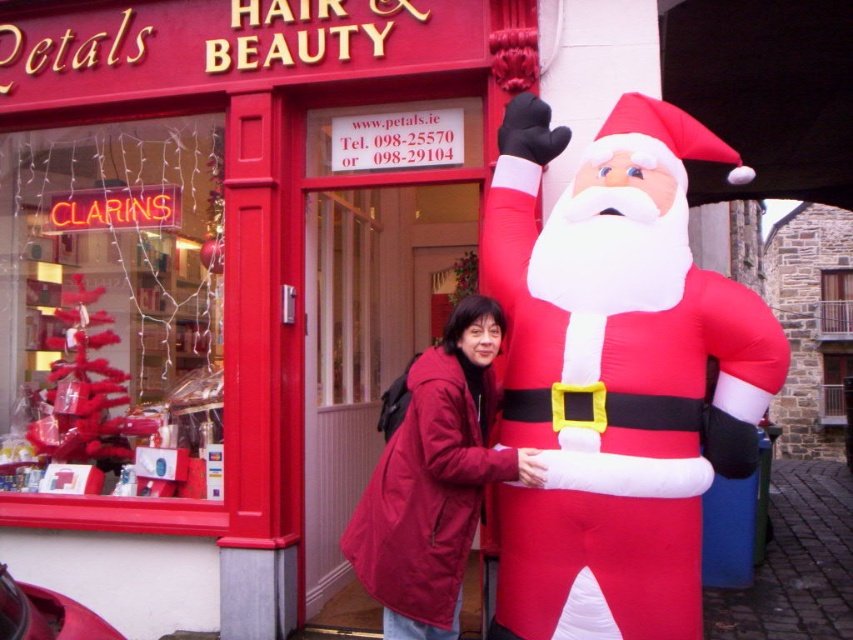
Is inflatable red santa claus at right smaller than matte red coat at center?

No.

Identify the location of inflatable red santa claus at right. The image size is (853, 640). (614, 376).

Is point (724, 332) closer to camera compared to point (410, 474)?

No, (724, 332) is behind (410, 474).

You are a GUI agent. You are given a task and a screenshot of the screen. Output one action in this format:
    pyautogui.click(x=<x>, y=<y>)
    Task: Click on the inflatable red santa claus at right
    This screenshot has height=640, width=853.
    Given the screenshot: What is the action you would take?
    pyautogui.click(x=614, y=376)

Between matte red store at center and matte red coat at center, which one appears on the right side from the viewer's perspective?

matte red coat at center

Is matte red store at center to the left of matte red coat at center from the viewer's perspective?

Yes, matte red store at center is to the left of matte red coat at center.

You are a GUI agent. You are given a task and a screenshot of the screen. Output one action in this format:
    pyautogui.click(x=<x>, y=<y>)
    Task: Click on the matte red store at center
    This screenshot has height=640, width=853.
    Given the screenshot: What is the action you would take?
    pyautogui.click(x=225, y=280)

Who is positioned more to the left, matte red store at center or inflatable red santa claus at right?

Positioned to the left is matte red store at center.

Who is positioned more to the right, matte red store at center or inflatable red santa claus at right?

inflatable red santa claus at right

Locate an element on the screen. This screenshot has width=853, height=640. matte red store at center is located at coordinates (225, 280).